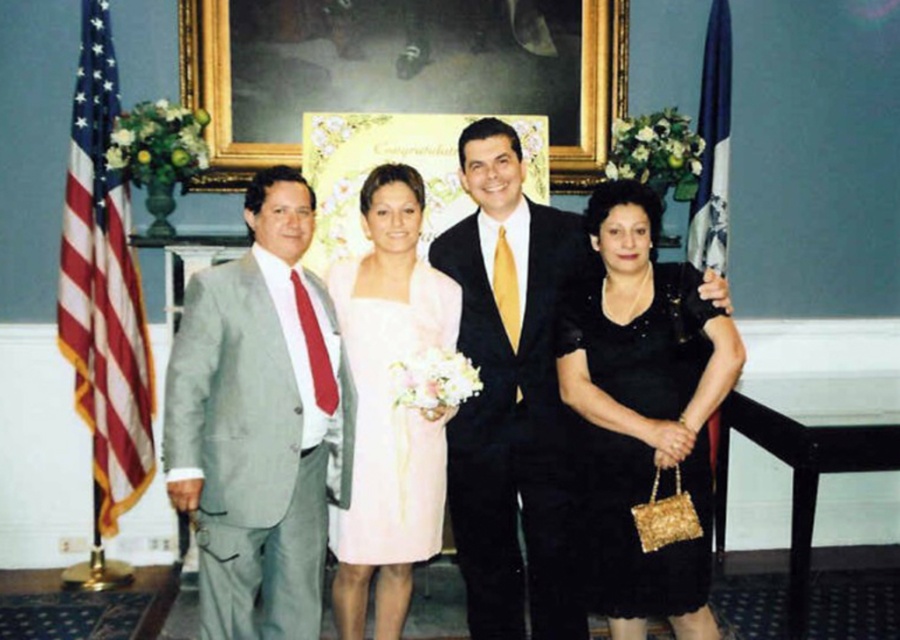
You are a photographer setting up for a group photo. You notice the black satin dress at center is currently 3.33 meters away from the camera. If your camera has a focal length of 50mm and you want to ensure the dress fills the frame properly, what adjustment should you make to the camera position?

Since the black satin dress at center is 3.33 meters from the camera, you should move closer to the dress to reduce the distance, allowing the 50mm lens to capture it adequately without cropping.